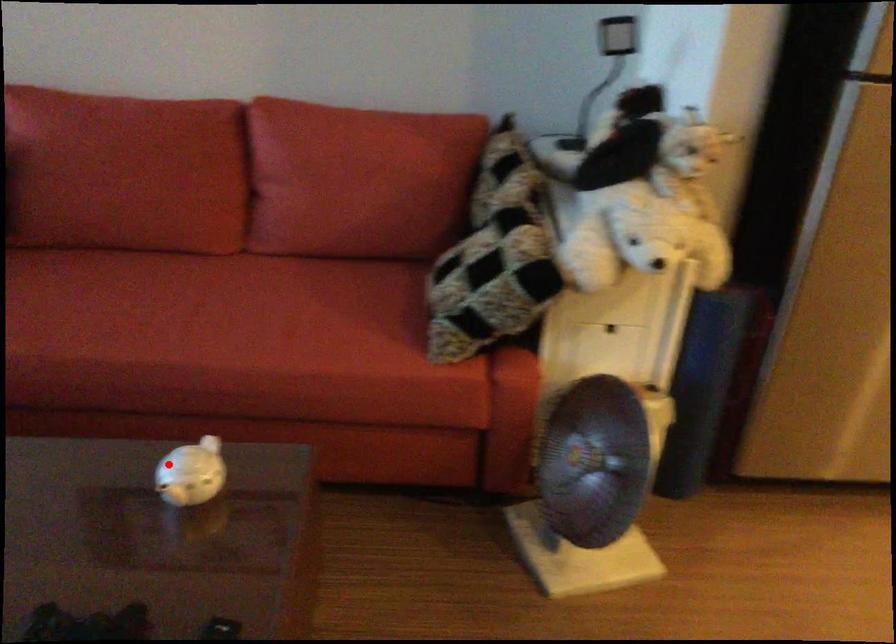
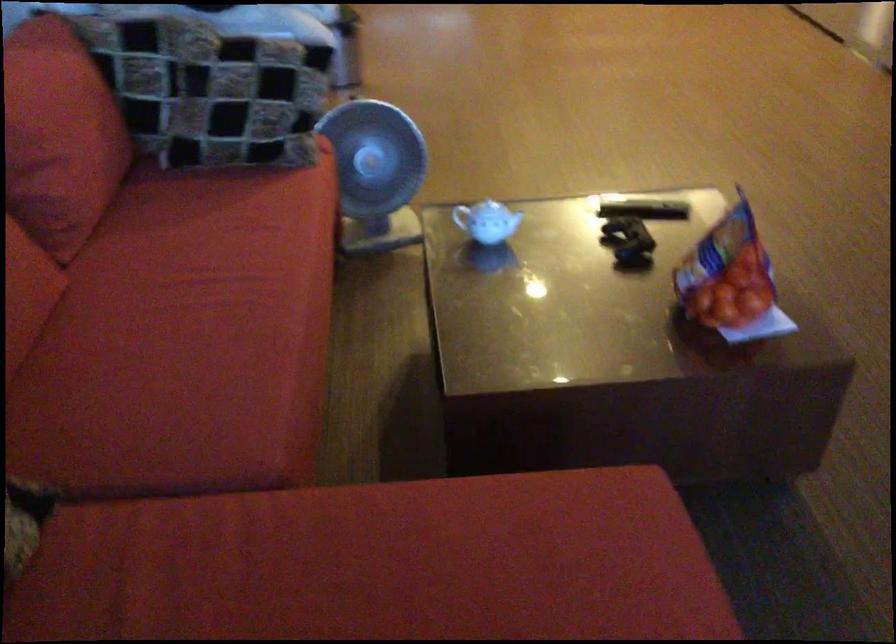
Find the pixel in the second image that matches the highlighted location in the first image.

(487, 220)